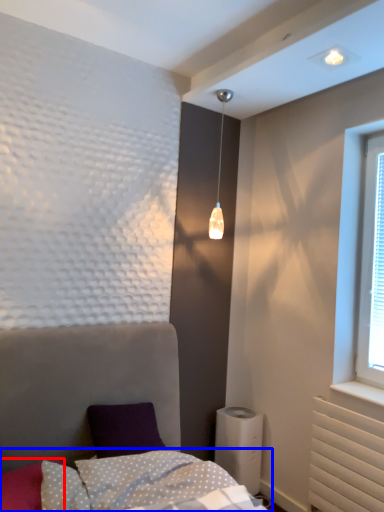
Question: Which of the following is the closest to the observer, pillow (highlighted by a red box) or bedding (highlighted by a blue box)?

Choices:
 (A) pillow
 (B) bedding

Answer: (B)